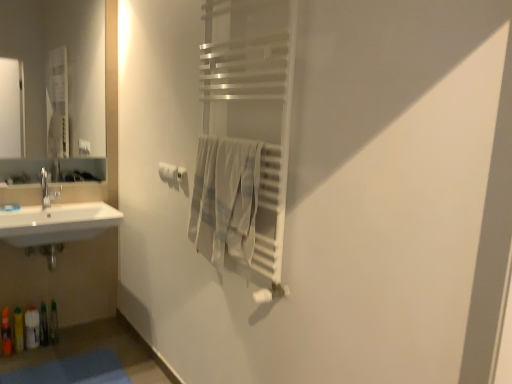
At what (x,y) coordinates should I click in order to perform the action: click on vacant area that is in front of translucent plastic bottles at lower left, the 3th toiletry in the right-to-left sequence. Please return your answer as a coordinate pair (x, y). Image resolution: width=512 pixels, height=384 pixels. Looking at the image, I should click on (16, 362).